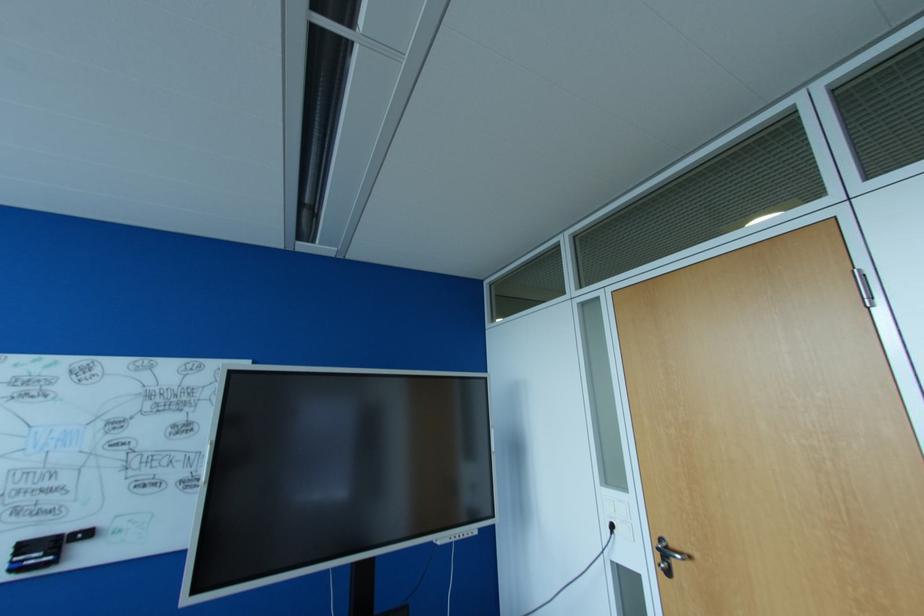
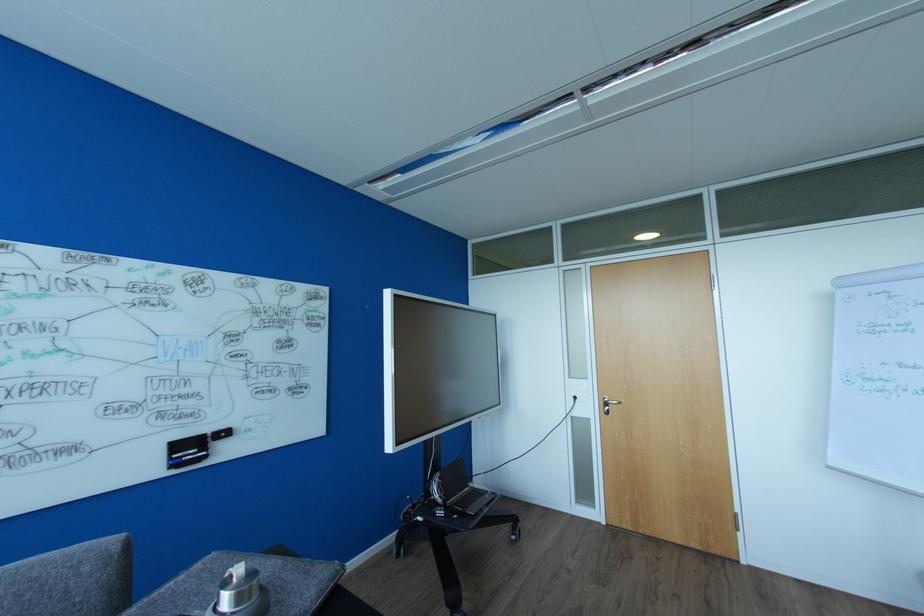
The point at (616, 525) is marked in the first image. Where is the corresponding point in the second image?

(578, 398)